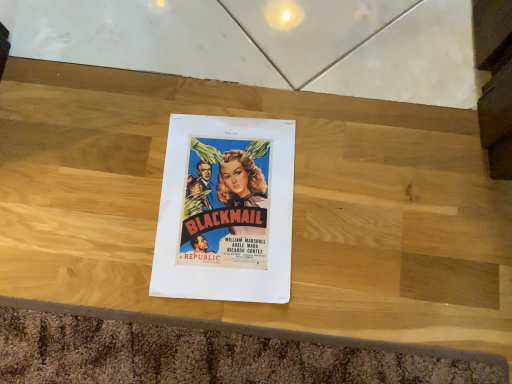
The width and height of the screenshot is (512, 384). Identify the location of blank space above matte paper poster at center (from a real-world perspective). (224, 196).